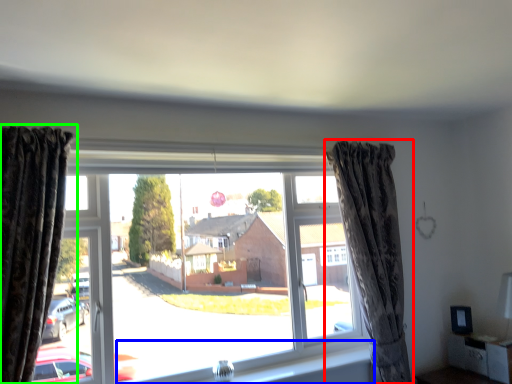
Question: Considering the real-world distances, which object is farthest from curtain (highlighted by a red box)? window sill (highlighted by a blue box) or curtain (highlighted by a green box)?

Choices:
 (A) window sill
 (B) curtain

Answer: (B)